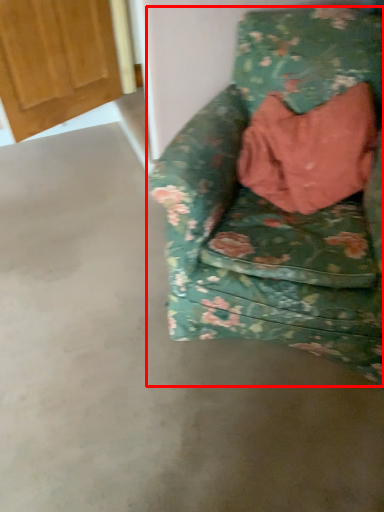
Question: Observing the image, what is the correct spatial positioning of chair (annotated by the red box) in reference to door?

Choices:
 (A) right
 (B) left

Answer: (A)